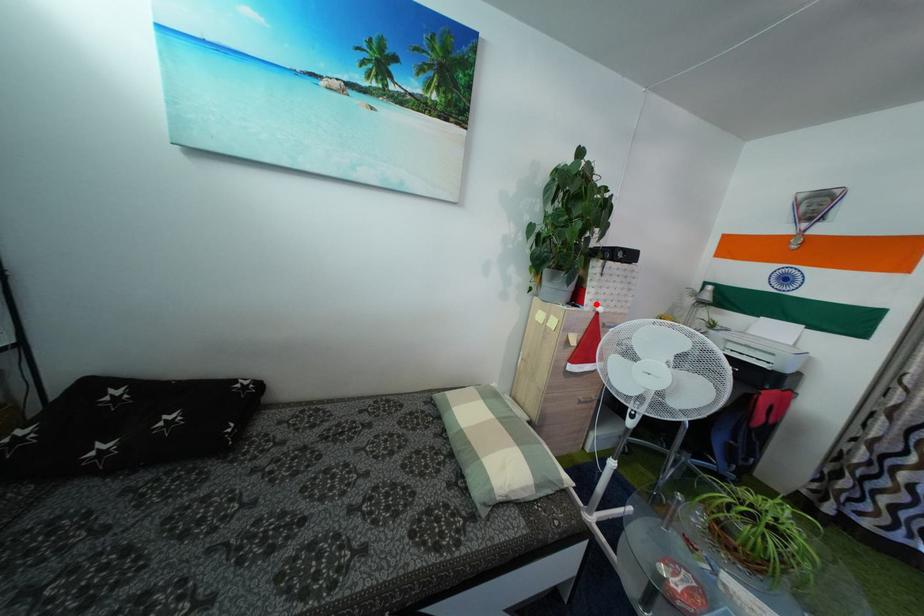
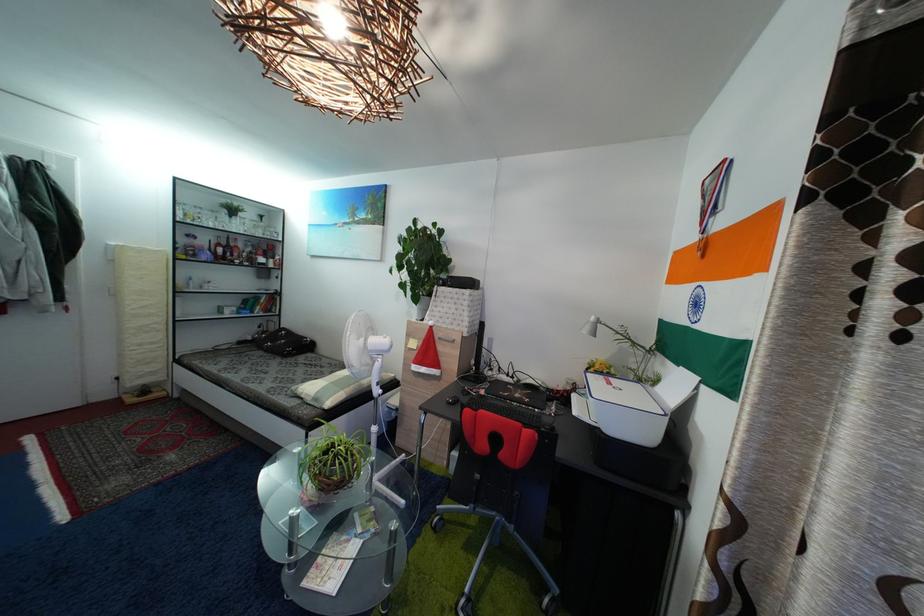
In the second image, find the point that corresponds to the highlighted location in the first image.

(435, 321)